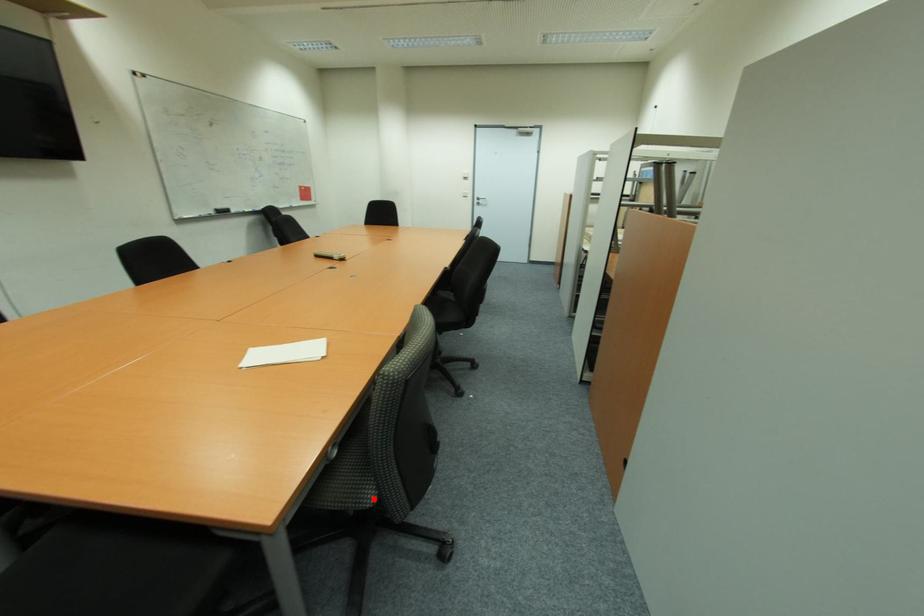
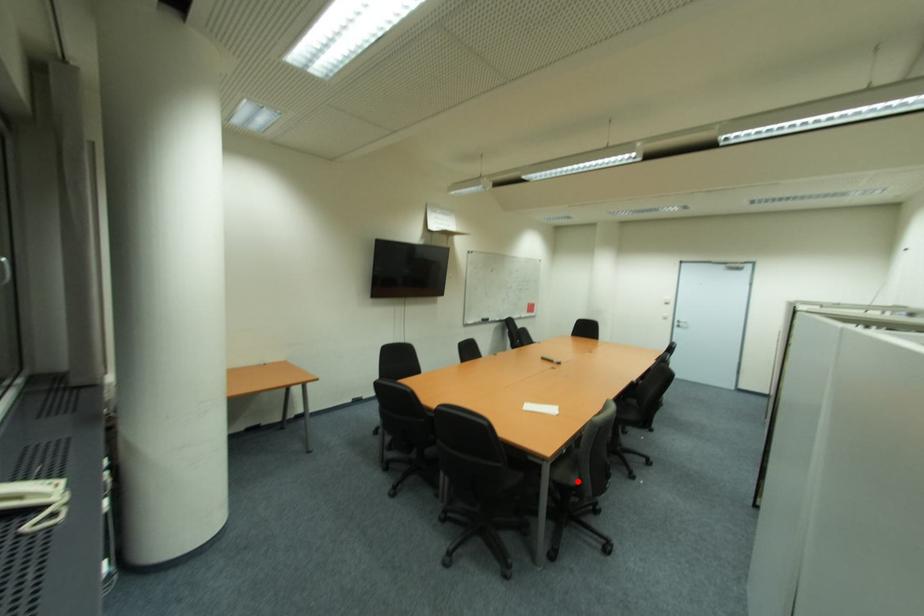
I am providing you with two images of the same scene from different viewpoints. A red point is marked on the first image and another point is marked on the second image. Do the highlighted points in image1 and image2 indicate the same real-world spot?

Yes